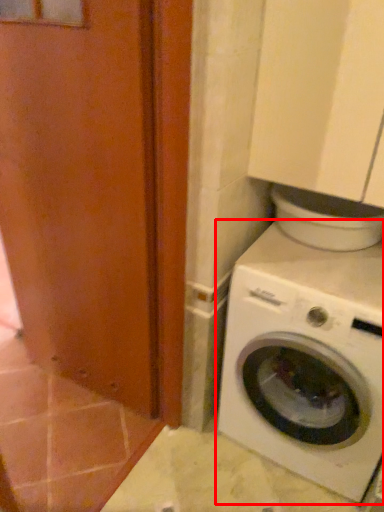
Question: Where is washing machine (annotated by the red box) located in relation to screen door in the image?

Choices:
 (A) right
 (B) left

Answer: (A)